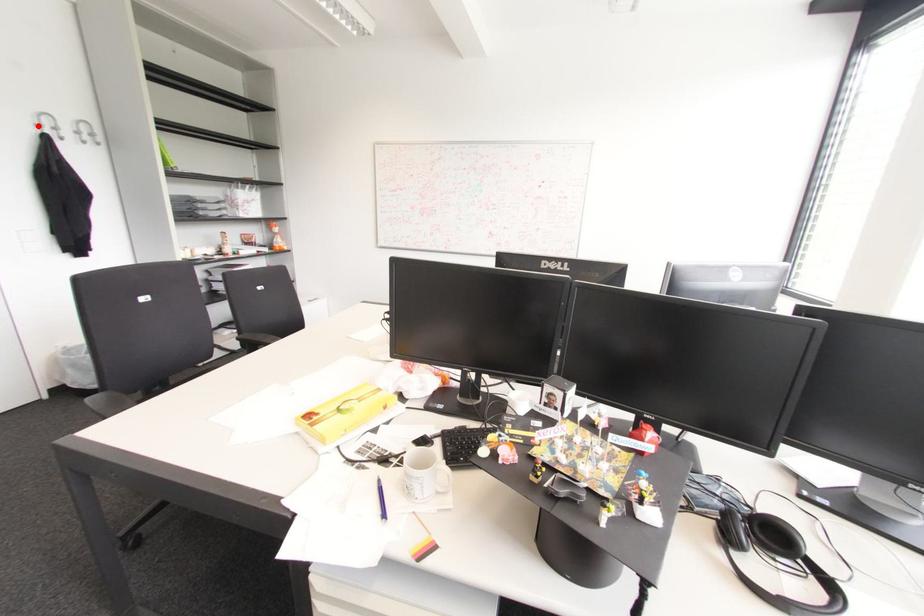
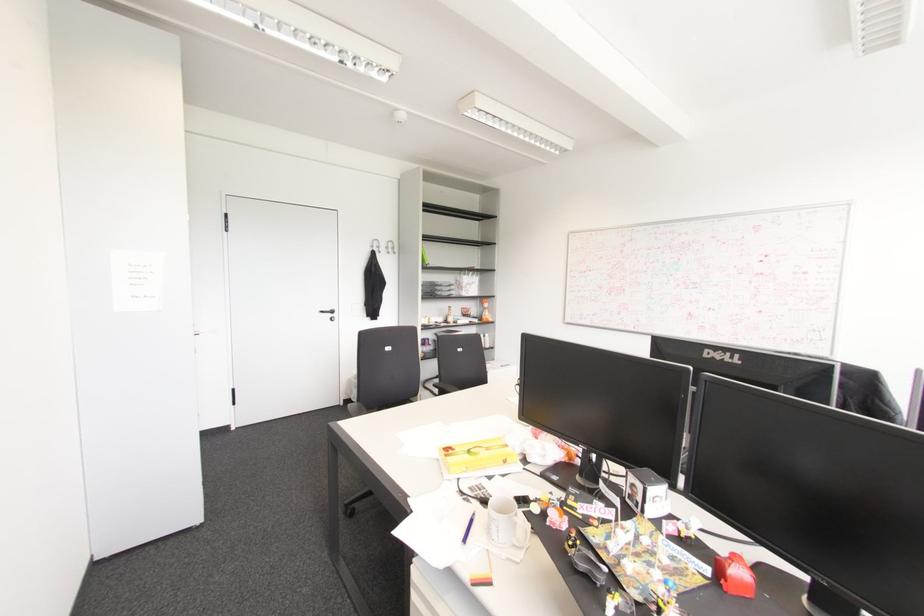
Question: I am providing you with two images of the same scene from different viewpoints. A red point is shown in image1. For the corresponding object point in image2, is it positioned nearer or farther from the camera?

Choices:
 (A) Nearer
 (B) Farther

Answer: (A)